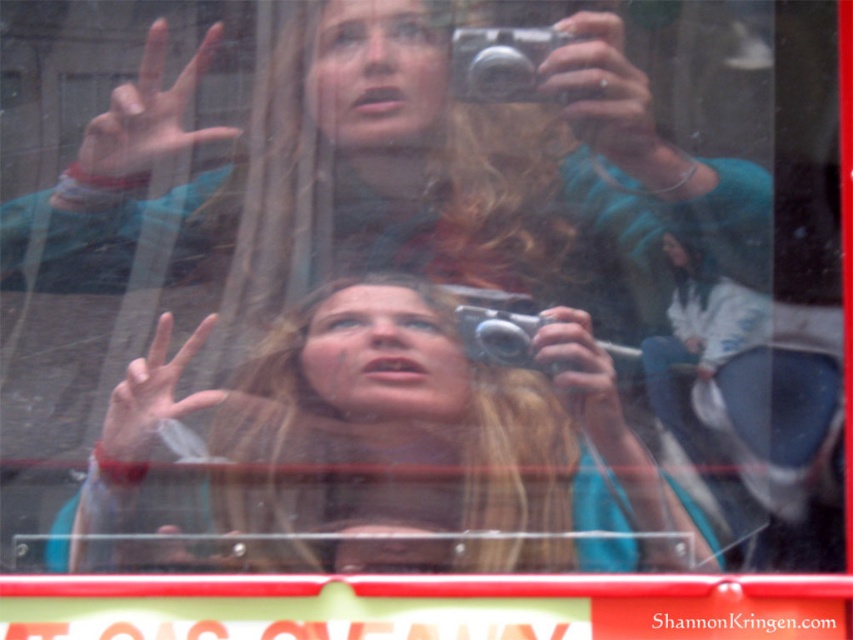
In the scene shown: You are standing in a vehicle and want to take a photo through the window. There are two points marked on the window at coordinates point (305, 316) and point (610, 358). Which point is closer to you when you are facing the window?

Point (305, 316) is behind point (610, 358), so the closer point to you when facing the window is point (610, 358).

You are a photographer trying to capture a shot through the foggy window. You notice the matte plastic hand at center and the silver metallic camera at upper center. Which object is bigger in the scene?

The matte plastic hand at center is larger in size than the silver metallic camera at upper center.

From the picture: Based on the scene description, where exactly is the blonde hair at center located in the image?

The blonde hair at center is located at point coordinates of [387,451].